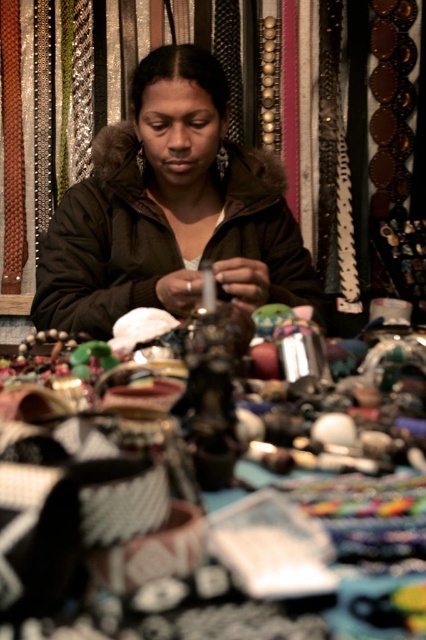
Is metallic silver bangles at center behind matte brown jacket at center?

No, metallic silver bangles at center is closer to the viewer.

You are a GUI agent. You are given a task and a screenshot of the screen. Output one action in this format:
    pyautogui.click(x=<x>, y=<y>)
    Task: Click on the metallic silver bangles at center
    This screenshot has height=640, width=426.
    Given the screenshot: What is the action you would take?
    pyautogui.click(x=187, y=531)